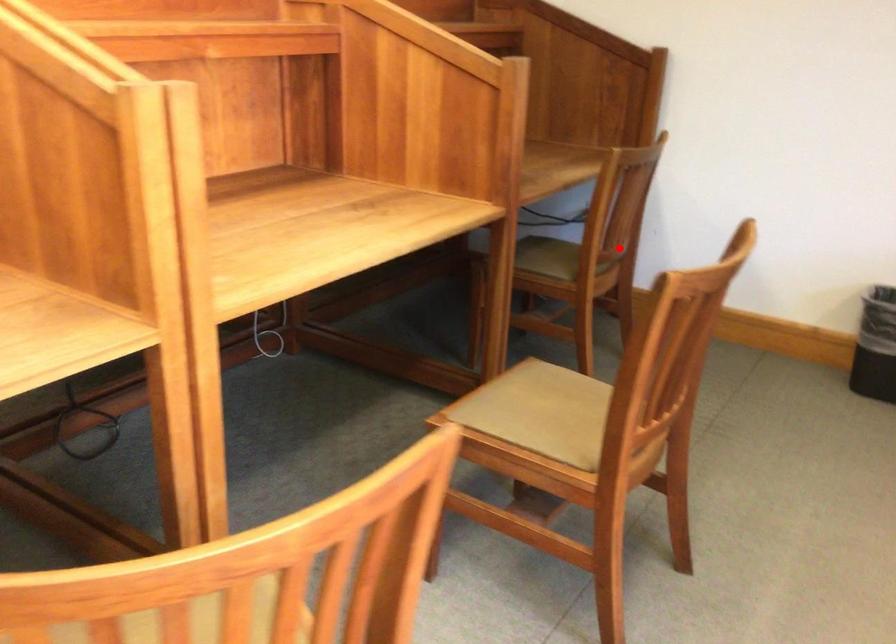
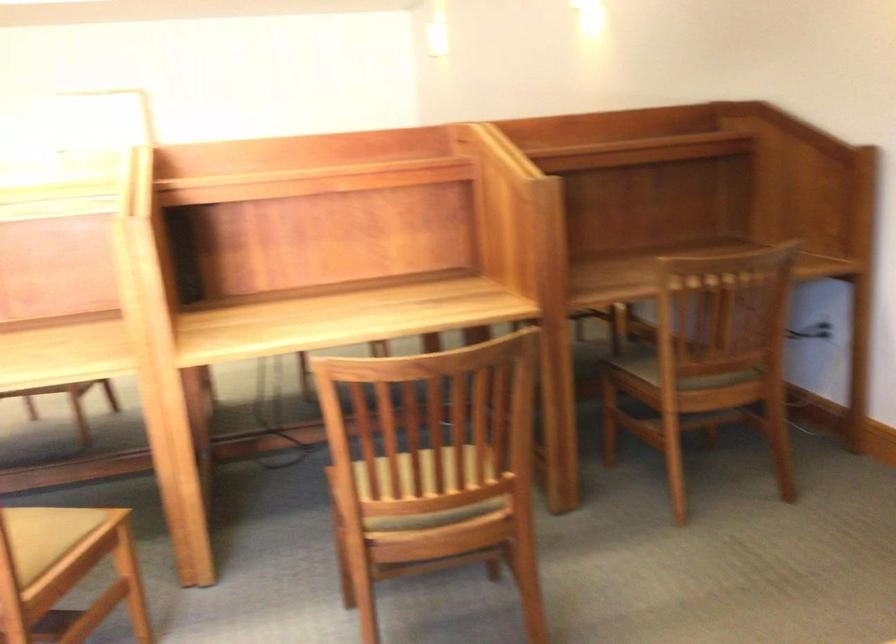
In the second image, find the point that corresponds to the highlighted location in the first image.

(698, 361)